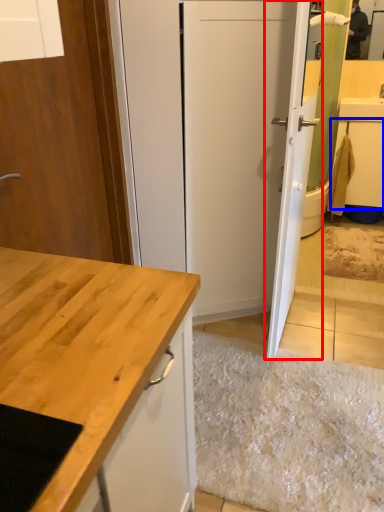
Question: Among these objects, which one is nearest to the camera, door (highlighted by a red box) or cabinetry (highlighted by a blue box)?

Choices:
 (A) door
 (B) cabinetry

Answer: (A)